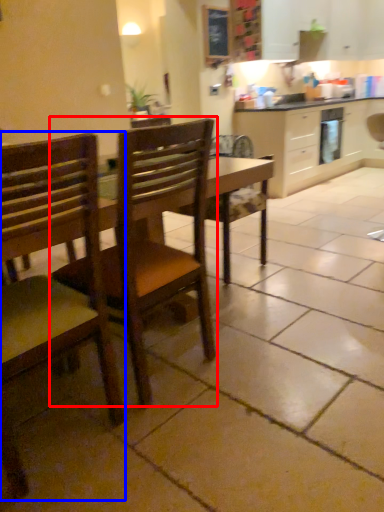
Question: Which object is further to the camera taking this photo, chair (highlighted by a red box) or chair (highlighted by a blue box)?

Choices:
 (A) chair
 (B) chair

Answer: (A)